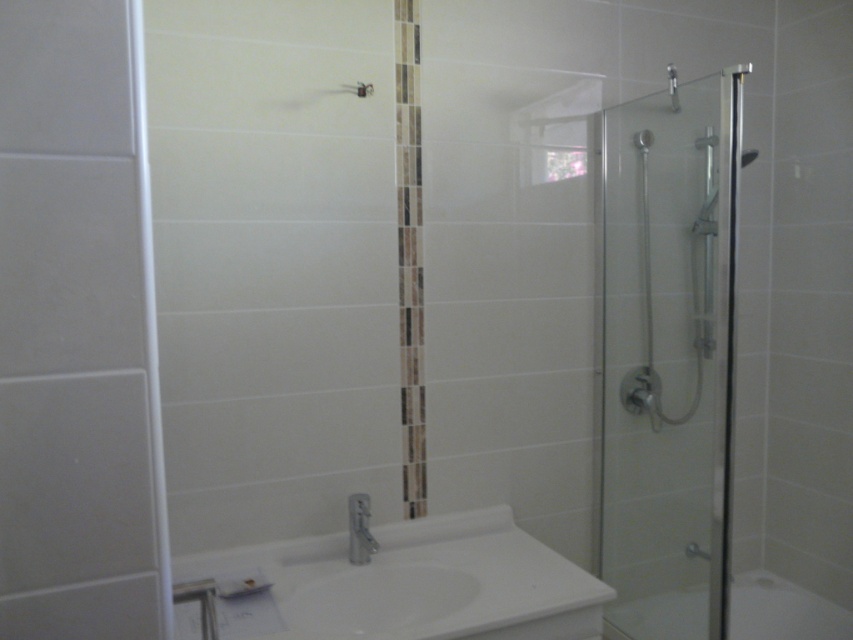
Can you confirm if transparent glass shower door at right is positioned below silver metallic faucet at lower center?

No.

Who is shorter, transparent glass shower door at right or silver metallic faucet at lower center?

silver metallic faucet at lower center is shorter.

Which is behind, point (705, 385) or point (352, 508)?

The point (705, 385) is behind.

Identify the location of transparent glass shower door at right. The image size is (853, 640). (666, 356).

Between point (514, 550) and point (376, 547), which one is positioned in front?

Point (376, 547)

Which is more to the left, white glossy sink at lower left or silver metallic faucet at lower center?

silver metallic faucet at lower center

Between point (459, 596) and point (350, 561), which one is positioned behind?

Positioned behind is point (350, 561).

You are a GUI agent. You are given a task and a screenshot of the screen. Output one action in this format:
    pyautogui.click(x=<x>, y=<y>)
    Task: Click on the white glossy sink at lower left
    The width and height of the screenshot is (853, 640).
    Given the screenshot: What is the action you would take?
    pyautogui.click(x=421, y=582)

Between point (393, 616) and point (850, 612), which one is positioned behind?

Point (850, 612)

What do you see at coordinates (421, 582) in the screenshot? I see `white glossy sink at lower left` at bounding box center [421, 582].

The image size is (853, 640). In order to click on white glossy sink at lower left in this screenshot , I will do `click(421, 582)`.